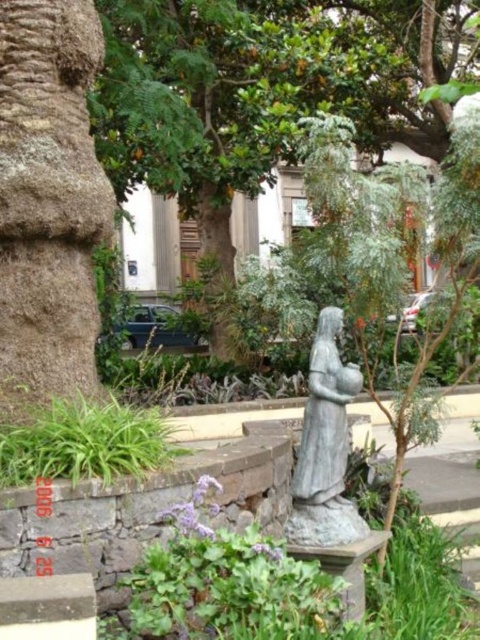
From the picture: You are a gardener who wants to plant a new flower bed between the green grass at lower left and the gray stone statue at center. Based on their positions, can you determine which area is closer to the front of the scene?

The green grass at lower left is in front of the gray stone statue at center, so the flower bed should be placed closer to the green grass at lower left as it is nearer to the front.

You are a gardener who needs to mow the green grass at lower left and clean around the gray stone statue at center. Which area requires more attention in terms of height? Explain your reasoning based on the scene description.

The gray stone statue at center is taller than the green grass at lower left, so the statue area requires more attention in terms of height for cleaning around it.

You are a gardener who needs to water the green grass at lower left without getting the gray stone statue at center wet. The watering can you have can spray water up to 36 inches. Can you water the grass without moving the statue?

The distance between the green grass at lower left and the gray stone statue at center is 38.68 inches, which is beyond the 36 inches spray range of the watering can. Therefore, you cannot water the grass without moving the statue.